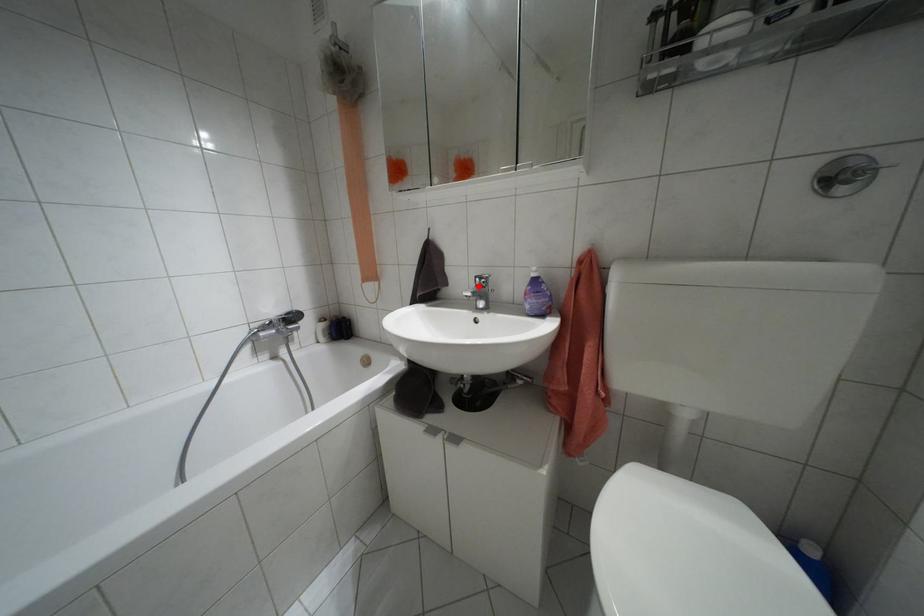
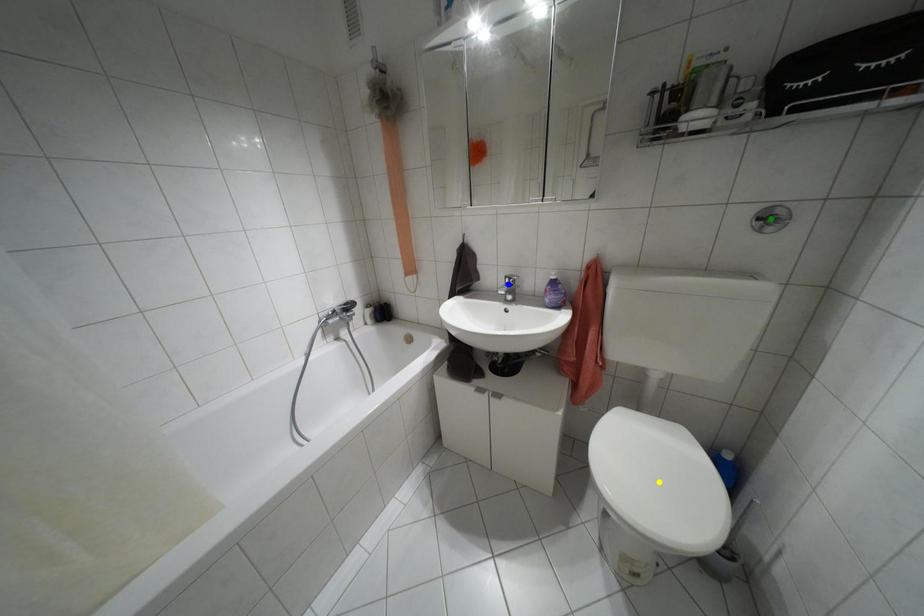
Question: I am providing you with two images of the same scene from different viewpoints. A red point is marked on the first image. You are given multiple points on the second image. Can you choose the point in image 2 that corresponds to the point in image 1?

Choices:
 (A) yellow point
 (B) green point
 (C) blue point

Answer: (C)